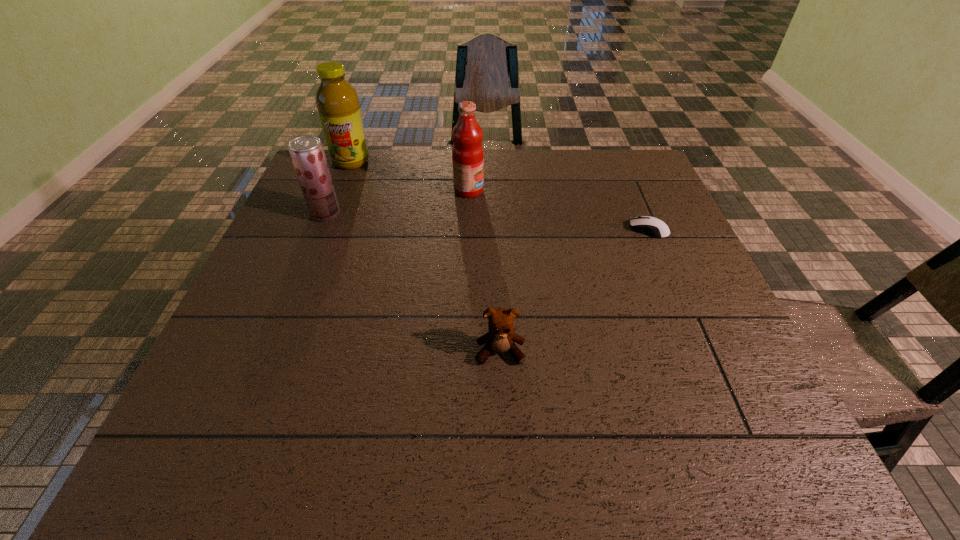
Locate an element on the screen. The height and width of the screenshot is (540, 960). vacant space at the near left corner is located at coordinates (189, 429).

In the image, there is a desktop. Where is `vacant space at the near right corner`? vacant space at the near right corner is located at coordinates (801, 472).

Identify the location of empty space between the second farthest fruit juice and the shortest object. (559, 210).

I want to click on free space between the rightmost object and the farthest fruit juice, so click(x=500, y=195).

Where is `vacant area that lies between the third tallest object and the farthest fruit juice`? The image size is (960, 540). vacant area that lies between the third tallest object and the farthest fruit juice is located at coordinates (338, 187).

Identify the location of vacant area that lies between the shortest object and the fourth tallest object. This screenshot has height=540, width=960. (574, 291).

You are a GUI agent. You are given a task and a screenshot of the screen. Output one action in this format:
    pyautogui.click(x=<x>, y=<y>)
    Task: Click on the unoccupied position between the nearest object and the farthest fruit juice
    Image resolution: width=960 pixels, height=540 pixels.
    Given the screenshot: What is the action you would take?
    pyautogui.click(x=425, y=256)

In order to click on free area in between the shortest object and the third shortest object in this screenshot , I will do click(487, 221).

The image size is (960, 540). I want to click on free point between the shortest fruit juice and the second shortest object, so click(x=413, y=282).

The image size is (960, 540). I want to click on vacant region between the nearest object and the mouse, so pos(574,291).